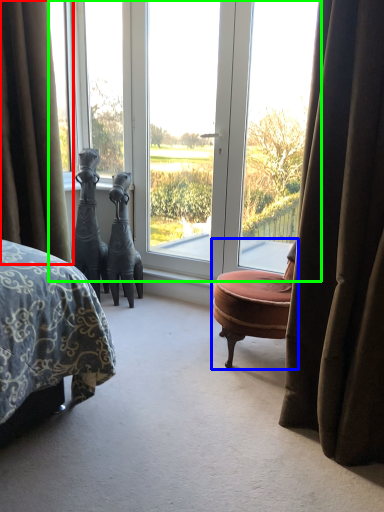
Question: Considering the real-world distances, which object is farthest from curtain (highlighted by a red box)? chair (highlighted by a blue box) or window (highlighted by a green box)?

Choices:
 (A) chair
 (B) window

Answer: (A)